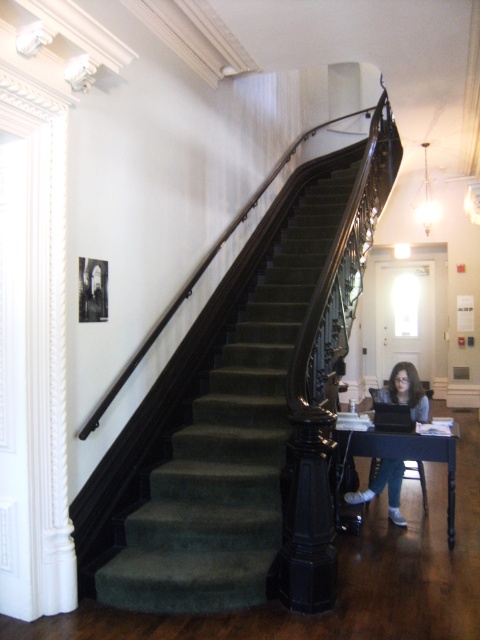
Is dark wood table at lower right taller than matte gray sweater at lower center?

Correct, dark wood table at lower right is much taller as matte gray sweater at lower center.

Where is `dark wood table at lower right`? Image resolution: width=480 pixels, height=640 pixels. dark wood table at lower right is located at coordinates (405, 456).

How distant is green velvet stairwell at center from matte gray sweater at lower center?

They are 1.20 meters apart.

Can you confirm if green velvet stairwell at center is smaller than matte gray sweater at lower center?

Incorrect, green velvet stairwell at center is not smaller in size than matte gray sweater at lower center.

You are a GUI agent. You are given a task and a screenshot of the screen. Output one action in this format:
    pyautogui.click(x=<x>, y=<y>)
    Task: Click on the green velvet stairwell at center
    The width and height of the screenshot is (480, 640).
    Given the screenshot: What is the action you would take?
    coord(229,442)

Does green velvet stairwell at center appear on the right side of dark wood table at lower right?

Incorrect, green velvet stairwell at center is not on the right side of dark wood table at lower right.

This screenshot has height=640, width=480. I want to click on green velvet stairwell at center, so 229,442.